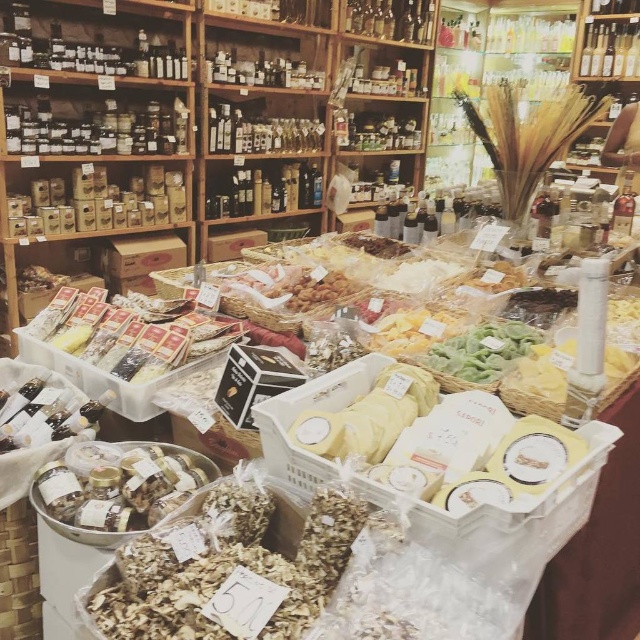
You are a customer in the deli and want to grab both the brown crumbly at center and the green leafy vegetables at center. Which one should you reach for first if you want to pick up the item that is lower?

The brown crumbly at center is below the green leafy vegetables at center, so you should reach for the brown crumbly at center first since it is lower.

You are a customer in the delicatessen and want to pick up both items located at point (x=259, y=513) and point (x=529, y=346). Which item should you pick up first to follow the natural path of the store layout?

You should pick up the item at point (x=259, y=513) first because it is in front of the other item at point (x=529, y=346), so it is closer to you.

You are standing in the delicatessen and want to pick up an item located at point [122,604]. If your arm can reach 3 feet, will you be able to reach it?

The distance between you and the point [122,604] is 3.59 feet, which is beyond your arm reach of 3 feet. Therefore, you won not be able to reach it.